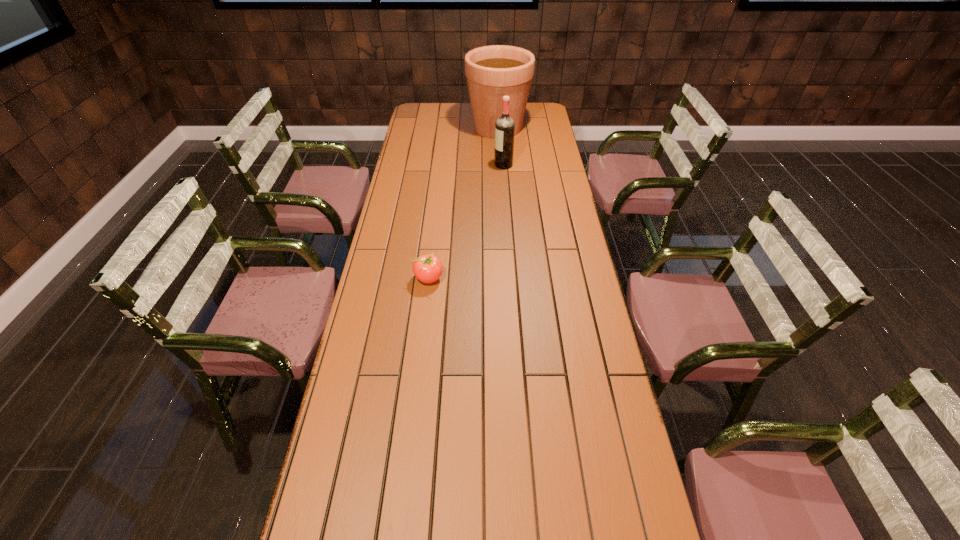
Locate an element on the screen. The height and width of the screenshot is (540, 960). vacant area that lies between the nearest object and the second nearest object is located at coordinates (467, 221).

Identify the location of empty location between the nearest object and the flowerpot. The height and width of the screenshot is (540, 960). (464, 203).

Identify the location of free area in between the farthest object and the nearest object. This screenshot has width=960, height=540. (464, 203).

This screenshot has height=540, width=960. I want to click on free area in between the farthest object and the leftmost object, so click(x=464, y=203).

The width and height of the screenshot is (960, 540). Find the location of `the closest object to the flowerpot`. the closest object to the flowerpot is located at coordinates (504, 126).

At what (x,y) coordinates should I click in order to perform the action: click on object that ranks as the closest to the farthest object. Please return your answer as a coordinate pair (x, y). Looking at the image, I should click on (504, 126).